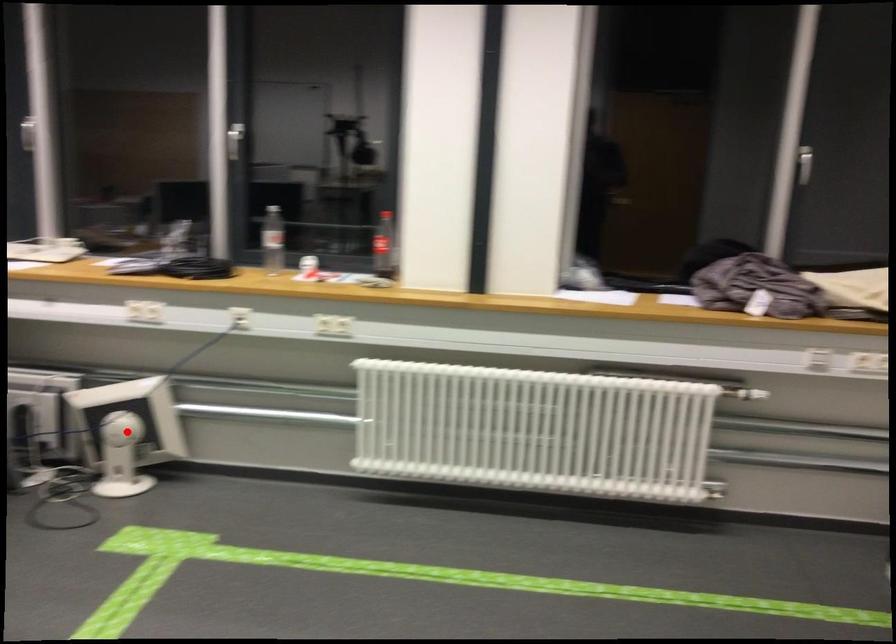
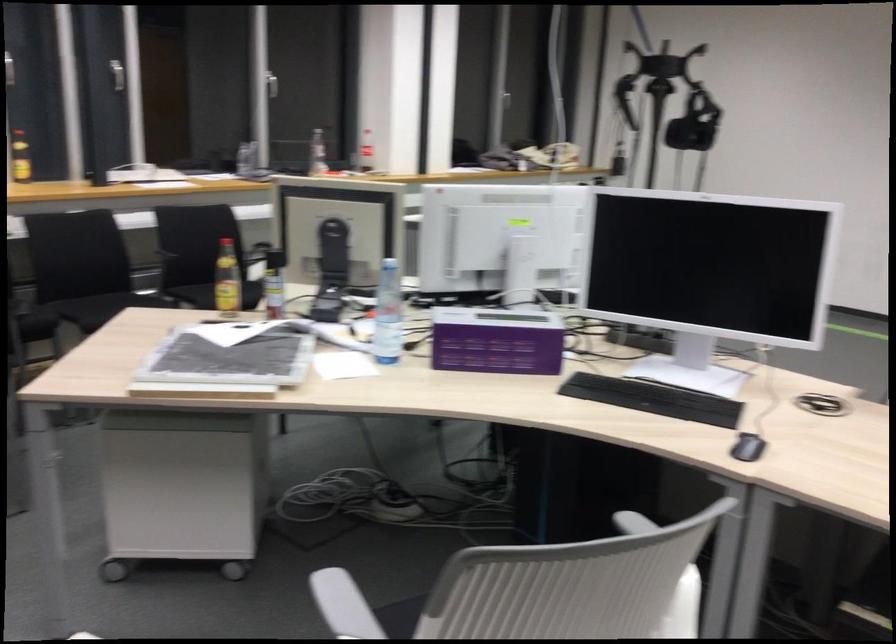
Question: I am providing you with two images of the same scene from different viewpoints. A red point is marked on the first image. Is the red point's position out of view in image 2?

Choices:
 (A) Yes
 (B) No

Answer: (A)